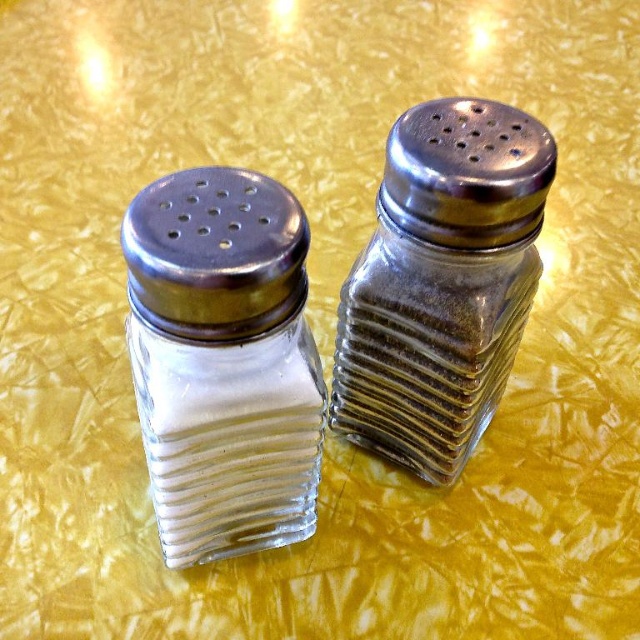
Looking at this image, you are standing in a kitchen and want to grab the clear glass salt shaker at left. If your hand can reach up to 30 inches, will you be able to reach it?

The clear glass salt shaker at left is 28.43 inches away from the viewer, so yes, your hand can reach it since it is within the 30 inch limit.

You are setting up a dining table and need to place the clear glass salt shaker at left and the clear glass pepper shaker at right so that both are visible to diners. Given their current positions, which shaker might be partially obscured and why?

The clear glass pepper shaker at right might be partially obscured because the clear glass salt shaker at left is positioned under it, potentially blocking part of the pepper shaker from view.